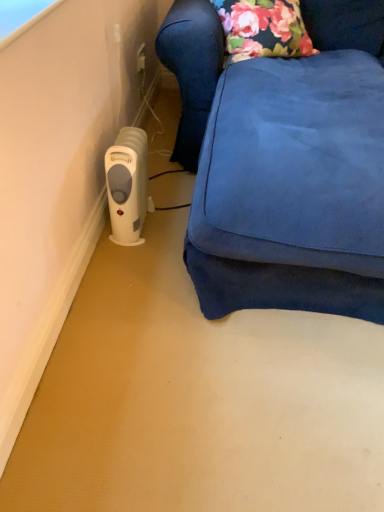
Image resolution: width=384 pixels, height=512 pixels. In order to click on space that is in front of white plastic heater at lower left in this screenshot , I will do `click(134, 271)`.